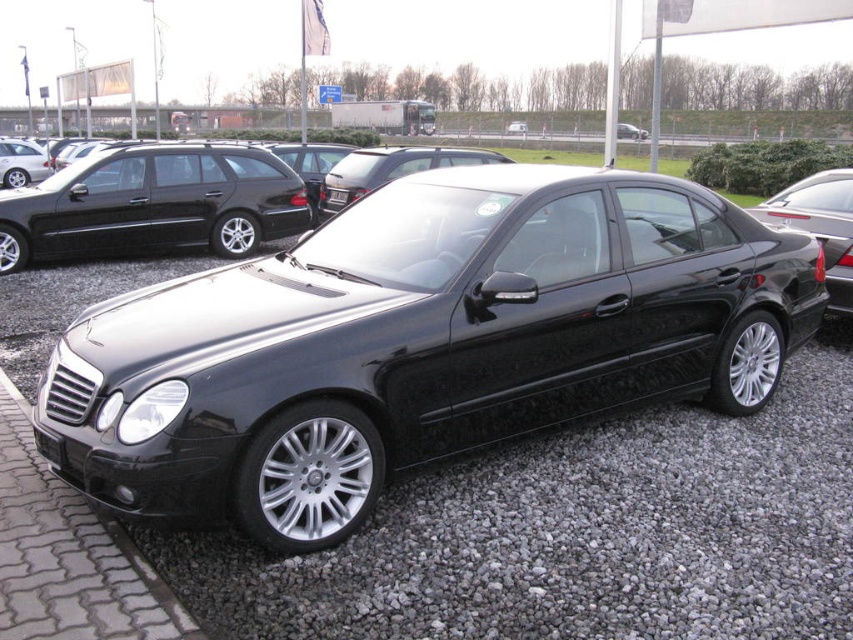
Does glossy black car at center have a smaller size compared to black metallic license plate at center?

No.

What do you see at coordinates (419, 340) in the screenshot?
I see `glossy black car at center` at bounding box center [419, 340].

Find the location of a particular element. The width and height of the screenshot is (853, 640). glossy black car at center is located at coordinates (419, 340).

The image size is (853, 640). Describe the element at coordinates (154, 204) in the screenshot. I see `matte black sedan at left` at that location.

Is matte black sedan at left wider than glossy black sedan at right?

Indeed, matte black sedan at left has a greater width compared to glossy black sedan at right.

Between point (247, 209) and point (822, 189), which one is positioned in front?

Point (822, 189) is more forward.

The height and width of the screenshot is (640, 853). In order to click on matte black sedan at left in this screenshot , I will do click(154, 204).

Who is positioned more to the left, gray gravel at lower center or cobblestone at lower left?

cobblestone at lower left

Is gray gravel at lower center to the left of cobblestone at lower left from the viewer's perspective?

In fact, gray gravel at lower center is to the right of cobblestone at lower left.

What do you see at coordinates (577, 534) in the screenshot? I see `gray gravel at lower center` at bounding box center [577, 534].

The height and width of the screenshot is (640, 853). In order to click on gray gravel at lower center in this screenshot , I will do `click(577, 534)`.